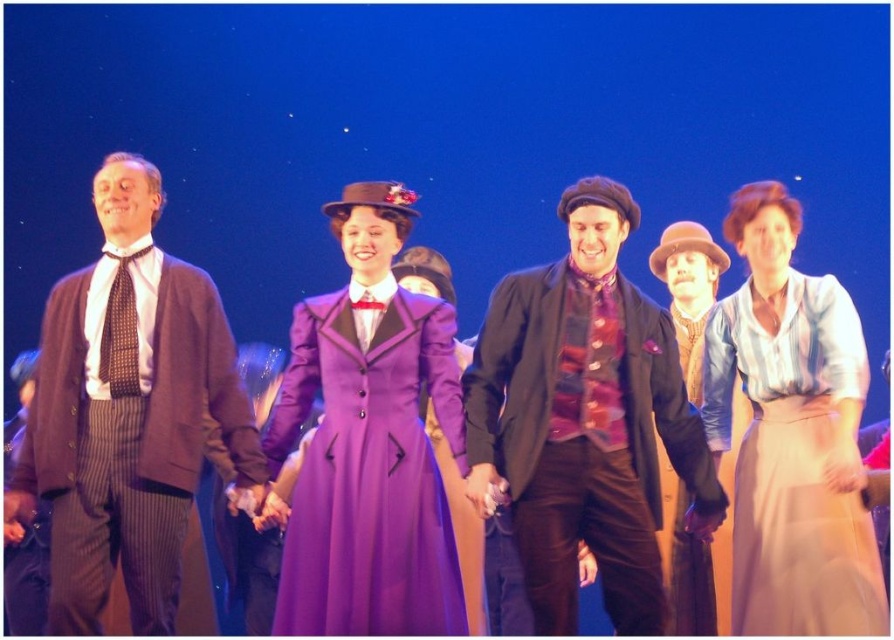
Which is more to the right, velvet black coat at center or striped wool suit at left?

Positioned to the right is velvet black coat at center.

Locate an element on the screen. Image resolution: width=894 pixels, height=640 pixels. velvet black coat at center is located at coordinates (584, 420).

This screenshot has width=894, height=640. In order to click on velvet black coat at center in this screenshot , I will do 584,420.

Can you confirm if velvet black coat at center is positioned above striped cotton blouse at right?

Incorrect, velvet black coat at center is not positioned above striped cotton blouse at right.

Which is more to the left, velvet black coat at center or striped cotton blouse at right?

velvet black coat at center

You are a GUI agent. You are given a task and a screenshot of the screen. Output one action in this format:
    pyautogui.click(x=<x>, y=<y>)
    Task: Click on the velvet black coat at center
    The height and width of the screenshot is (640, 894).
    Given the screenshot: What is the action you would take?
    pyautogui.click(x=584, y=420)

Does point (241, 426) come farther from viewer compared to point (781, 561)?

Yes, it is.

Does striped wool suit at left lie behind striped cotton blouse at right?

Yes, striped wool suit at left is behind striped cotton blouse at right.

Image resolution: width=894 pixels, height=640 pixels. Identify the location of striped wool suit at left. (128, 413).

You are a GUI agent. You are given a task and a screenshot of the screen. Output one action in this format:
    pyautogui.click(x=<x>, y=<y>)
    Task: Click on the striped wool suit at left
    Image resolution: width=894 pixels, height=640 pixels.
    Given the screenshot: What is the action you would take?
    pyautogui.click(x=128, y=413)